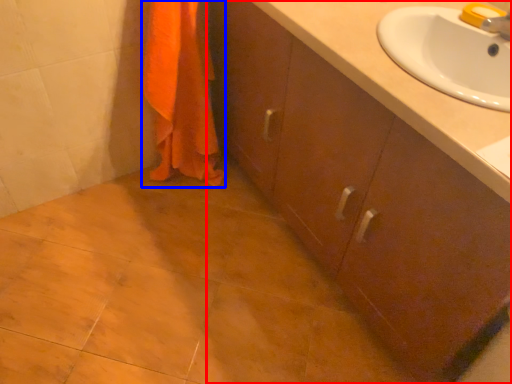
Question: Which of the following is the farthest to the observer, bathroom cabinet (highlighted by a red box) or bath towel (highlighted by a blue box)?

Choices:
 (A) bathroom cabinet
 (B) bath towel

Answer: (B)